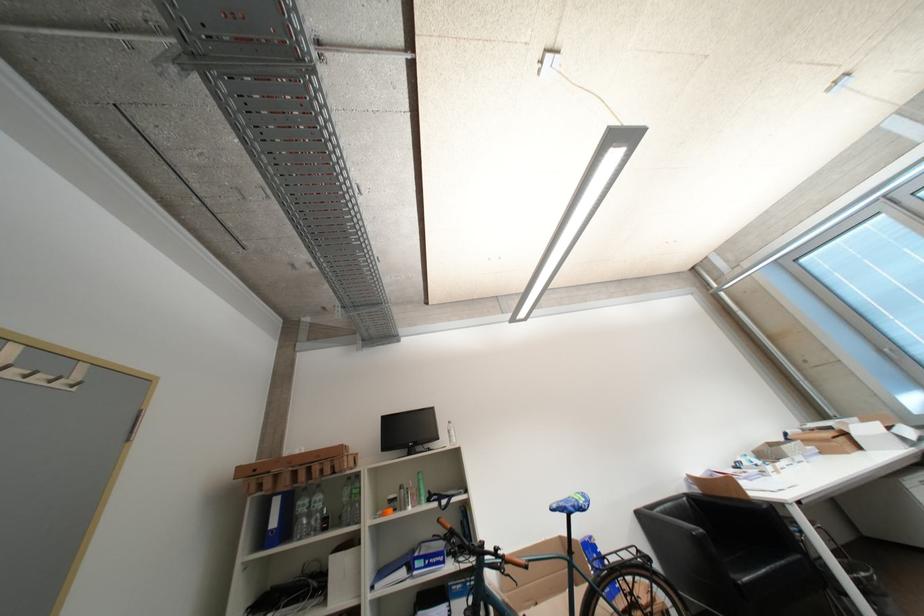
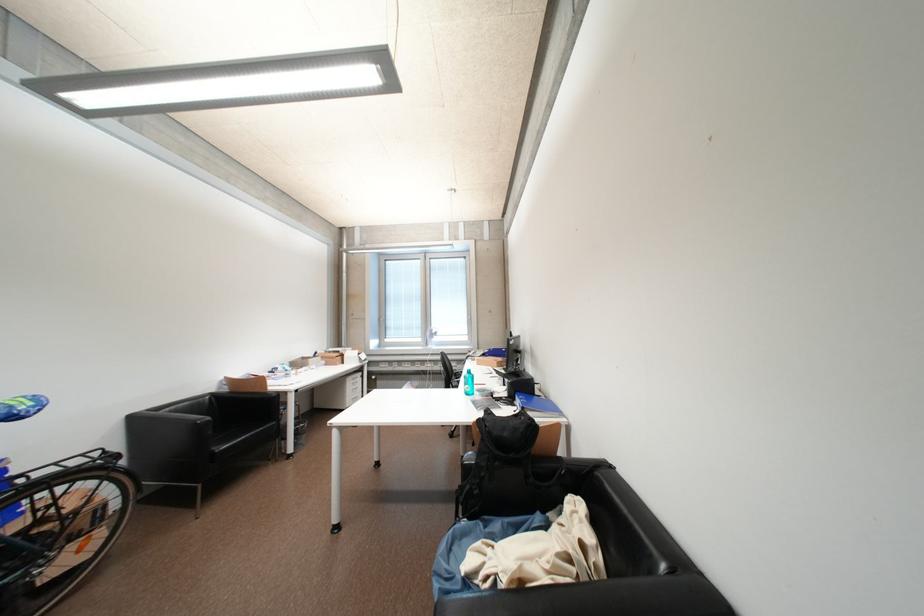
The point at (745, 586) is marked in the first image. Where is the corresponding point in the second image?

(221, 456)